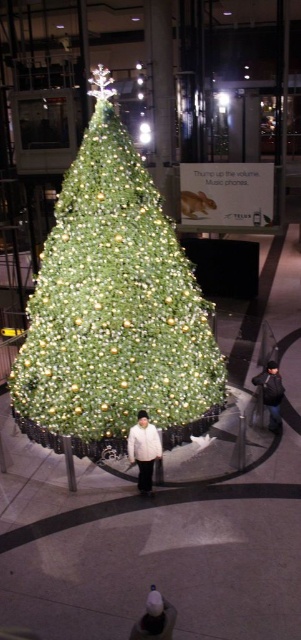
Does white knit cap at center appear over dark gray knit hat at lower right?

No.

Between white knit cap at center and dark gray knit hat at lower right, which one has less height?

white knit cap at center

Locate an element on the screen. white knit cap at center is located at coordinates (155, 618).

Can you confirm if white matte jacket at center is smaller than dark gray knit hat at lower right?

Indeed, white matte jacket at center has a smaller size compared to dark gray knit hat at lower right.

Where is `white matte jacket at center`? white matte jacket at center is located at coordinates (143, 449).

Who is more distant from viewer, (185, 385) or (276, 432)?

Positioned behind is point (276, 432).

Is point (108, 276) in front of point (284, 394)?

Yes, it is.

The height and width of the screenshot is (640, 301). I want to click on green matte christmas tree at center, so click(114, 308).